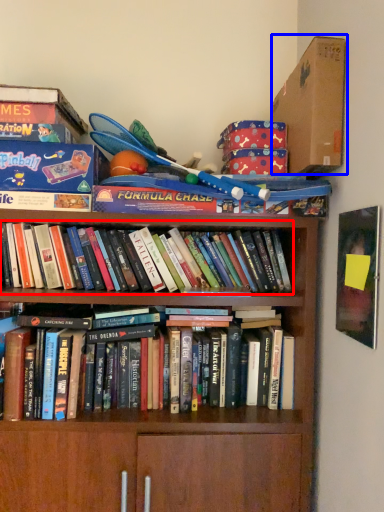
Question: Which of the following is the farthest to the observer, book (highlighted by a red box) or cardboard box (highlighted by a blue box)?

Choices:
 (A) book
 (B) cardboard box

Answer: (A)